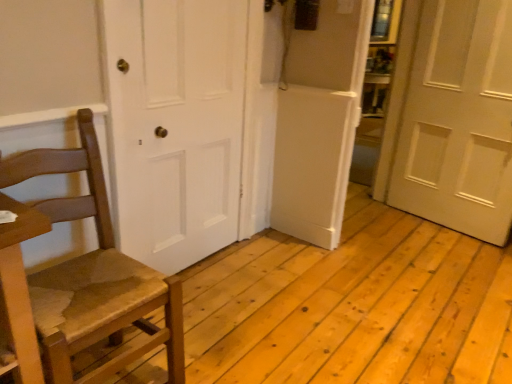
You are a GUI agent. You are given a task and a screenshot of the screen. Output one action in this format:
    pyautogui.click(x=<x>, y=<y>)
    Task: Click on the vacant space underneath white matte door at right, the second door in the left-to-right sequence (from a real-world perspective)
    The width and height of the screenshot is (512, 384).
    Given the screenshot: What is the action you would take?
    pyautogui.click(x=434, y=225)